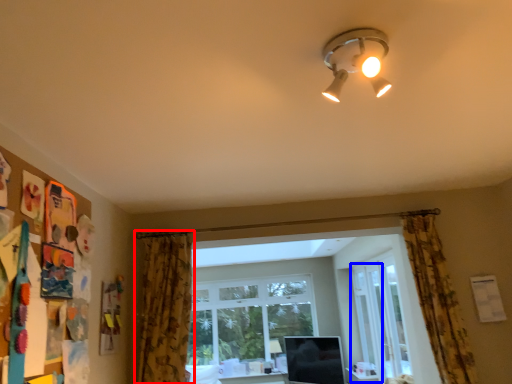
Question: Which object appears closest to the camera in this image, curtain (highlighted by a red box) or screen door (highlighted by a blue box)?

Choices:
 (A) curtain
 (B) screen door

Answer: (A)